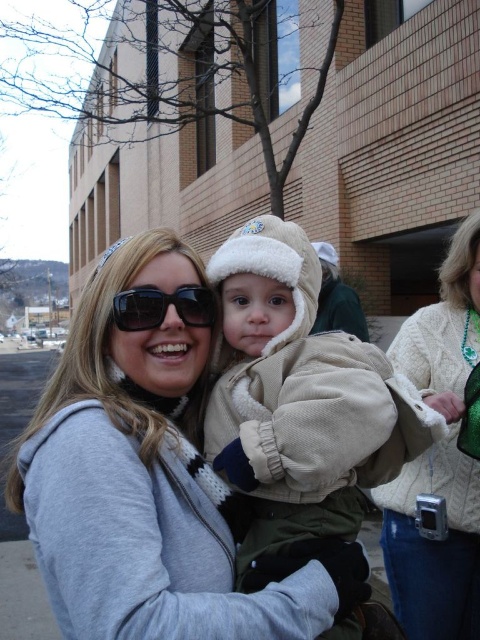
Can you confirm if ivory cable knit sweater at lower right is positioned below matte black sunglasses at center?

Correct, ivory cable knit sweater at lower right is located below matte black sunglasses at center.

The width and height of the screenshot is (480, 640). What do you see at coordinates (439, 460) in the screenshot?
I see `ivory cable knit sweater at lower right` at bounding box center [439, 460].

Locate an element on the screen. The height and width of the screenshot is (640, 480). ivory cable knit sweater at lower right is located at coordinates (439, 460).

Can you confirm if beige fleece jacket at center is thinner than matte black sunglasses at center?

No, beige fleece jacket at center is not thinner than matte black sunglasses at center.

Is point (266, 516) positioned in front of point (151, 310)?

Yes.

Describe the element at coordinates (300, 396) in the screenshot. I see `beige fleece jacket at center` at that location.

Where is `beige fleece jacket at center`? This screenshot has height=640, width=480. beige fleece jacket at center is located at coordinates (300, 396).

In the scene shown: Is matte gray hoodie at center wider than beige fleece jacket at center?

Correct, the width of matte gray hoodie at center exceeds that of beige fleece jacket at center.

Does matte gray hoodie at center come in front of beige fleece jacket at center?

Yes, it is.

The image size is (480, 640). I want to click on matte gray hoodie at center, so click(147, 481).

Locate an element on the screen. This screenshot has height=640, width=480. matte gray hoodie at center is located at coordinates (147, 481).